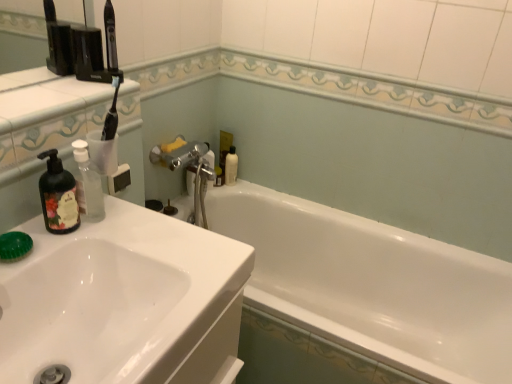
Question: Is translucent plastic bottle at upper center taller than white glossy bathtub at center?

Choices:
 (A) yes
 (B) no

Answer: (B)

Question: Considering the relative sizes of translucent plastic bottle at upper center and white glossy bathtub at center in the image provided, is translucent plastic bottle at upper center thinner than white glossy bathtub at center?

Choices:
 (A) no
 (B) yes

Answer: (B)

Question: Considering the relative sizes of translucent plastic bottle at upper center and white glossy bathtub at center in the image provided, is translucent plastic bottle at upper center shorter than white glossy bathtub at center?

Choices:
 (A) yes
 (B) no

Answer: (A)

Question: Does translucent plastic bottle at upper center have a greater width compared to white glossy bathtub at center?

Choices:
 (A) yes
 (B) no

Answer: (B)

Question: Is translucent plastic bottle at upper center at the left side of white glossy bathtub at center?

Choices:
 (A) no
 (B) yes

Answer: (B)

Question: Considering their positions, is translucent plastic bottle at upper center located in front of or behind matte black soap dispenser at left?

Choices:
 (A) behind
 (B) front

Answer: (A)

Question: Would you say translucent plastic bottle at upper center is to the left or to the right of matte black soap dispenser at left in the picture?

Choices:
 (A) left
 (B) right

Answer: (B)

Question: From their relative heights in the image, would you say translucent plastic bottle at upper center is taller or shorter than matte black soap dispenser at left?

Choices:
 (A) tall
 (B) short

Answer: (B)

Question: In terms of size, does translucent plastic bottle at upper center appear bigger or smaller than matte black soap dispenser at left?

Choices:
 (A) small
 (B) big

Answer: (A)

Question: Based on their sizes in the image, would you say matte black soap dispenser at left is bigger or smaller than white glossy bathtub at center?

Choices:
 (A) small
 (B) big

Answer: (A)

Question: Would you say matte black soap dispenser at left is to the left or to the right of white glossy bathtub at center in the picture?

Choices:
 (A) left
 (B) right

Answer: (A)

Question: Does point 50,173 appear closer or farther from the camera than point 410,238?

Choices:
 (A) closer
 (B) farther

Answer: (A)

Question: In the image, is matte black soap dispenser at left positioned in front of or behind white glossy bathtub at center?

Choices:
 (A) behind
 (B) front

Answer: (B)

Question: Considering the positions of white glossy bathtub at center and matte black soap dispenser at left in the image, is white glossy bathtub at center wider or thinner than matte black soap dispenser at left?

Choices:
 (A) thin
 (B) wide

Answer: (B)

Question: From the image's perspective, is white glossy bathtub at center positioned above or below matte black soap dispenser at left?

Choices:
 (A) below
 (B) above

Answer: (A)